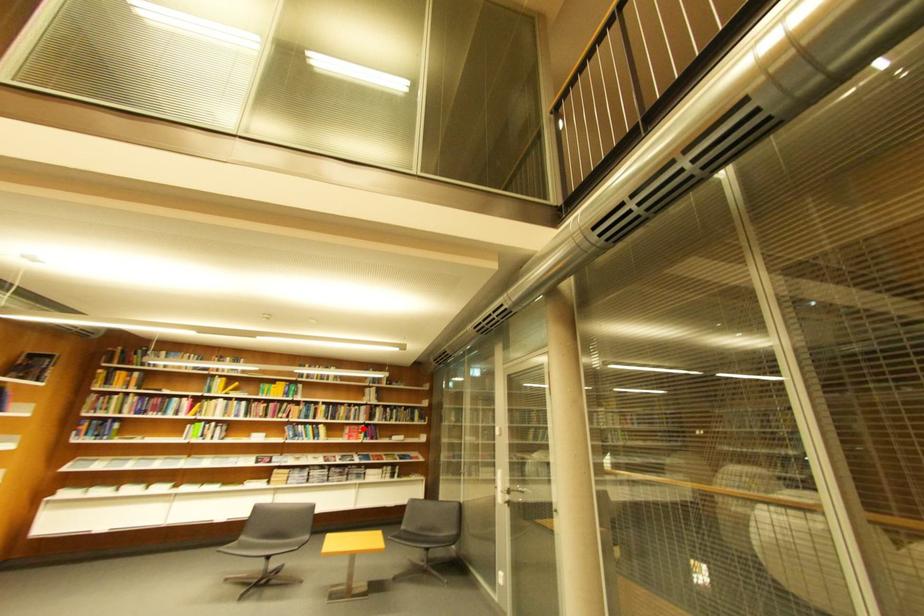
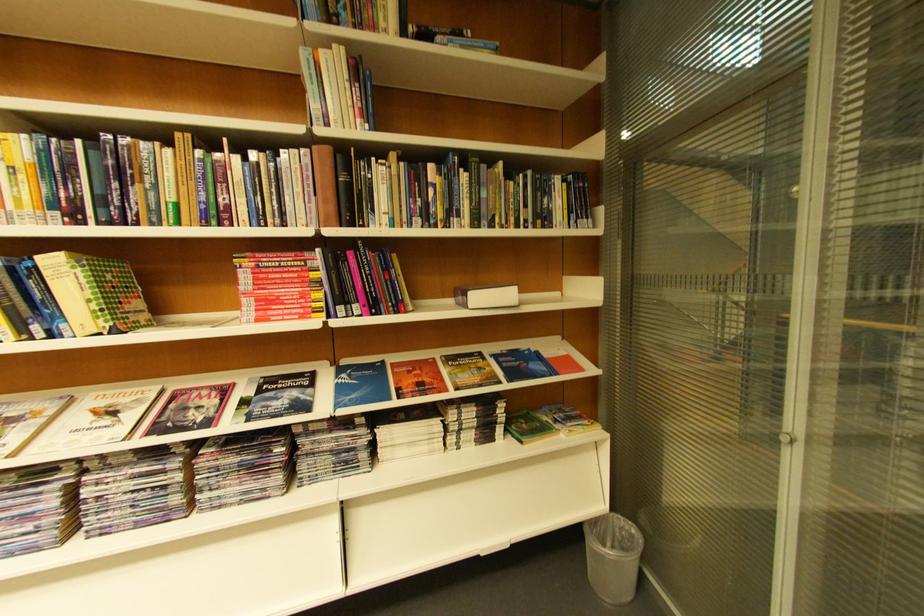
Question: A red point is marked in image1. In image2, is the corresponding 3D point closer to the camera or farther? Reply with the corresponding letter.

Choices:
 (A) The corresponding 3D point is closer.
 (B) The corresponding 3D point is farther.

Answer: (A)